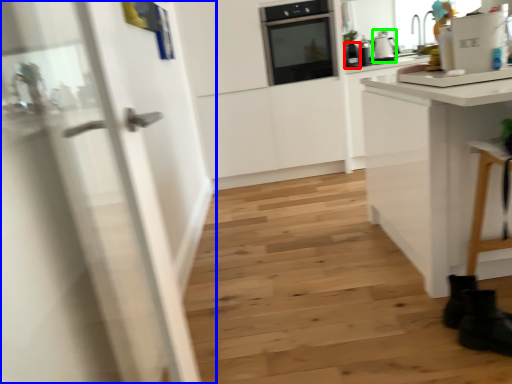
Question: Which is farther away from kitchen appliance (highlighted by a red box)? door (highlighted by a blue box) or kitchen appliance (highlighted by a green box)?

Choices:
 (A) door
 (B) kitchen appliance

Answer: (A)